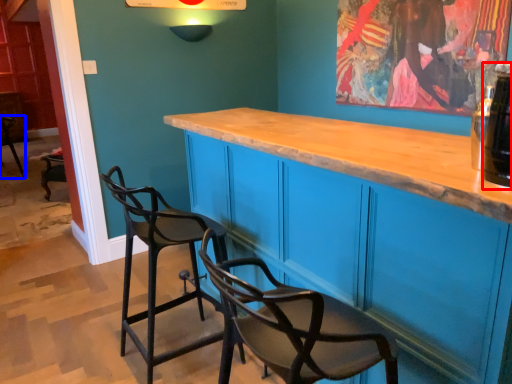
Question: Which point is closer to the camera, beverage (highlighted by a red box) or chair (highlighted by a blue box)?

Choices:
 (A) beverage
 (B) chair

Answer: (A)